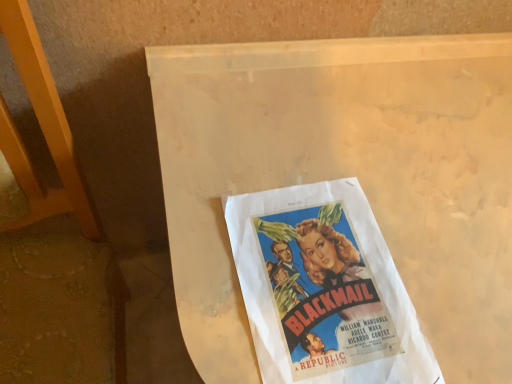
Where is `unoccupied region to the right of vintage paper poster at center`? unoccupied region to the right of vintage paper poster at center is located at coordinates (455, 274).